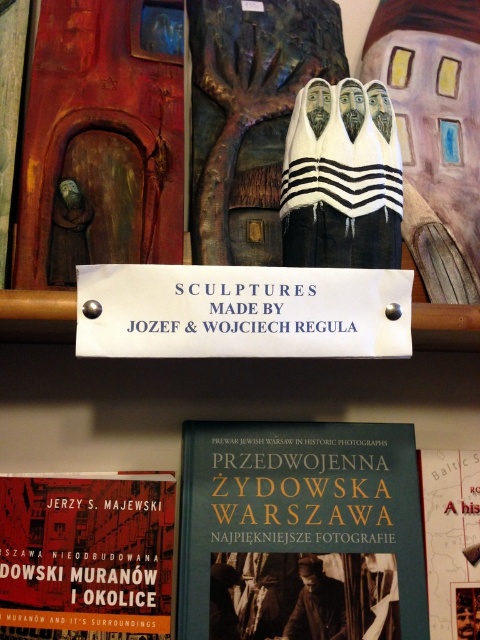
You are a visitor at the exhibition and want to place a 30 cm wide decorative item between the matte red book at lower left and the matte paper book at center. Is there enough space?

The distance between the matte red book at lower left and the matte paper book at center is 35.57 centimeters. Since the decorative item is 30 cm wide, there is enough space to place it between them.

You are a researcher examining the display and need to access both the hardcover book at center and the matte red book at lower left. Which book should you move first to reach the one behind it?

You should move the hardcover book at center first because it is closer to you than the matte red book at lower left, which is behind it.